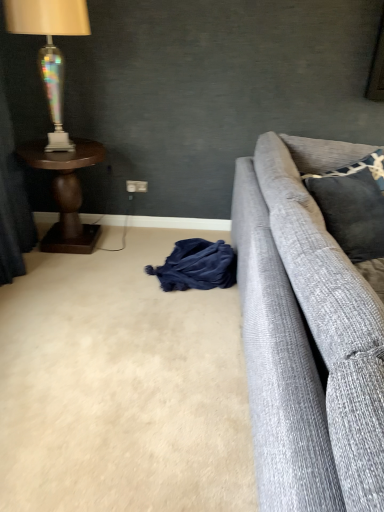
The width and height of the screenshot is (384, 512). What do you see at coordinates (353, 205) in the screenshot?
I see `dark gray textured pillow at right, acting as the 1th pillow starting from the bottom` at bounding box center [353, 205].

The height and width of the screenshot is (512, 384). What do you see at coordinates (197, 266) in the screenshot? I see `dark blue fabric at lower center` at bounding box center [197, 266].

Identify the location of dark brown wood side table at left. This screenshot has height=512, width=384. (66, 193).

How much space does dark gray fabric pillow at upper right, arranged as the second pillow when ordered from the bottom, occupy horizontally?

dark gray fabric pillow at upper right, arranged as the second pillow when ordered from the bottom, is 17.37 centimeters in width.

The height and width of the screenshot is (512, 384). What do you see at coordinates (50, 50) in the screenshot? I see `iridescent glass lamp at left` at bounding box center [50, 50].

Find the location of `white plastic power outlet at center`. white plastic power outlet at center is located at coordinates (136, 186).

Image resolution: width=384 pixels, height=512 pixels. Find the location of `dark gray textured pillow at right, marked as the 2th pillow in a top-to-bottom arrangement`. dark gray textured pillow at right, marked as the 2th pillow in a top-to-bottom arrangement is located at coordinates click(x=353, y=205).

From the image's perspective, which is above, white plastic power outlet at center or beige carpet at lower left?

From the image's view, white plastic power outlet at center is above.

Where is `plain in front of the white plastic power outlet at center`? plain in front of the white plastic power outlet at center is located at coordinates (122, 386).

Considering the sizes of white plastic power outlet at center and beige carpet at lower left in the image, is white plastic power outlet at center wider or thinner than beige carpet at lower left?

In the image, white plastic power outlet at center appears to be more narrow than beige carpet at lower left.

Which is closer to the camera, (134, 186) or (104, 290)?

Point (134, 186).

Between point (312, 185) and point (1, 213), which one is positioned in front?

The point (312, 185) is more forward.

Which of these two, dark gray textured pillow at right, acting as the 1th pillow starting from the bottom, or velvet dark blue curtain at left, stands shorter?

Standing shorter between the two is dark gray textured pillow at right, acting as the 1th pillow starting from the bottom.

Does dark gray textured pillow at right, acting as the 1th pillow starting from the bottom, appear on the left side of velvet dark blue curtain at left?

In fact, dark gray textured pillow at right, acting as the 1th pillow starting from the bottom, is to the right of velvet dark blue curtain at left.

Image resolution: width=384 pixels, height=512 pixels. I want to click on material that appears on the left of dark gray textured pillow at right, acting as the 1th pillow starting from the bottom, so click(197, 266).

Does dark blue fabric at lower center turn towards dark gray textured pillow at right, acting as the 1th pillow starting from the bottom?

No, dark blue fabric at lower center is not facing towards dark gray textured pillow at right, acting as the 1th pillow starting from the bottom.

Is dark blue fabric at lower center in front of dark gray textured pillow at right, marked as the 2th pillow in a top-to-bottom arrangement?

No.

Is dark blue fabric at lower center thinner than dark gray textured pillow at right, marked as the 2th pillow in a top-to-bottom arrangement?

Incorrect, the width of dark blue fabric at lower center is not less than that of dark gray textured pillow at right, marked as the 2th pillow in a top-to-bottom arrangement.

From a real-world perspective, is velvet dark blue curtain at left beneath iridescent glass lamp at left?

Yes, from a real-world perspective, velvet dark blue curtain at left is beneath iridescent glass lamp at left.

Can you confirm if velvet dark blue curtain at left is shorter than iridescent glass lamp at left?

No.

From the image's perspective, between velvet dark blue curtain at left and iridescent glass lamp at left, which one is located above?

From the image's view, iridescent glass lamp at left is above.

Is iridescent glass lamp at left located within velvet dark blue curtain at left?

No, iridescent glass lamp at left is not a part of velvet dark blue curtain at left.

Does dark blue fabric at lower center have a greater height compared to dark brown wood side table at left?

Incorrect, the height of dark blue fabric at lower center is not larger of that of dark brown wood side table at left.

From the picture: Is dark blue fabric at lower center thinner than dark brown wood side table at left?

Correct, the width of dark blue fabric at lower center is less than that of dark brown wood side table at left.

Which point is more forward, [222,282] or [53,226]?

The point [222,282] is closer.

Are dark brown wood side table at left and white plastic power outlet at center located far from each other?

dark brown wood side table at left is actually quite close to white plastic power outlet at center.

Between dark brown wood side table at left and white plastic power outlet at center, which one has larger size?

dark brown wood side table at left.

Consider the image. Is dark brown wood side table at left oriented away from white plastic power outlet at center?

That's not correct — dark brown wood side table at left is not looking away from white plastic power outlet at center.

Is point (47, 372) in front of point (233, 263)?

Yes, it is.

Based on the photo, considering the relative sizes of beige carpet at lower left and dark blue fabric at lower center in the image provided, is beige carpet at lower left taller than dark blue fabric at lower center?

No, beige carpet at lower left is not taller than dark blue fabric at lower center.

From the image's perspective, relative to dark blue fabric at lower center, is beige carpet at lower left above or below?

From the image's perspective, beige carpet at lower left appears below dark blue fabric at lower center.

Which is in front, beige carpet at lower left or dark blue fabric at lower center?

Positioned in front is beige carpet at lower left.

Locate an element on the screen. This screenshot has height=512, width=384. plain below the white plastic power outlet at center (from a real-world perspective) is located at coordinates (122, 386).

From the velvet dark blue curtain at left, count 2nd pillow to the right and point to it. Please provide its 2D coordinates.

[(353, 205)]

From the image, which object appears to be farther from white plastic power outlet at center, dark blue fabric at lower center or iridescent glass lamp at left?

The object further to white plastic power outlet at center is dark blue fabric at lower center.

Which object lies nearer to the anchor point dark blue fabric at lower center, dark gray fabric pillow at upper right, the 1th pillow positioned from the top, or dark brown wood side table at left?

dark brown wood side table at left is closer to dark blue fabric at lower center.

Estimate the real-world distances between objects in this image. Which object is closer to beige carpet at lower left, dark blue fabric at lower center or white plastic power outlet at center?

dark blue fabric at lower center is positioned closer to the anchor beige carpet at lower left.

In the scene shown: Estimate the real-world distances between objects in this image. Which object is further from dark gray fabric pillow at upper right, arranged as the second pillow when ordered from the bottom, dark blue fabric at lower center or white plastic power outlet at center?

white plastic power outlet at center lies further to dark gray fabric pillow at upper right, arranged as the second pillow when ordered from the bottom, than the other object.

Based on their spatial positions, is beige carpet at lower left or dark gray textured pillow at right, acting as the 1th pillow starting from the bottom, further from dark gray fabric pillow at upper right, arranged as the second pillow when ordered from the bottom?

beige carpet at lower left lies further to dark gray fabric pillow at upper right, arranged as the second pillow when ordered from the bottom, than the other object.

When comparing their distances from dark blue fabric at lower center, does beige carpet at lower left or dark brown wood side table at left seem closer?

beige carpet at lower left lies closer to dark blue fabric at lower center than the other object.

Based on their spatial positions, is dark gray textured pillow at right, acting as the 1th pillow starting from the bottom, or velvet dark blue curtain at left closer to dark gray fabric pillow at upper right, arranged as the second pillow when ordered from the bottom?

Among the two, dark gray textured pillow at right, acting as the 1th pillow starting from the bottom, is located nearer to dark gray fabric pillow at upper right, arranged as the second pillow when ordered from the bottom.

Considering their positions, is beige carpet at lower left positioned further to white plastic power outlet at center than dark brown wood side table at left?

Based on the image, beige carpet at lower left appears to be further to white plastic power outlet at center.

Where is `power outlet situated between velvet dark blue curtain at left and dark gray textured pillow at right, acting as the 1th pillow starting from the bottom, from left to right`? The image size is (384, 512). power outlet situated between velvet dark blue curtain at left and dark gray textured pillow at right, acting as the 1th pillow starting from the bottom, from left to right is located at coordinates (136, 186).

In order to click on table between velvet dark blue curtain at left and white plastic power outlet at center in the front-back direction in this screenshot , I will do `click(66, 193)`.

Identify the location of table located between velvet dark blue curtain at left and dark blue fabric at lower center in the left-right direction. This screenshot has height=512, width=384. (66, 193).

Find the location of a particular element. The width and height of the screenshot is (384, 512). table between velvet dark blue curtain at left and dark gray fabric pillow at upper right, arranged as the second pillow when ordered from the bottom, from left to right is located at coordinates (66, 193).